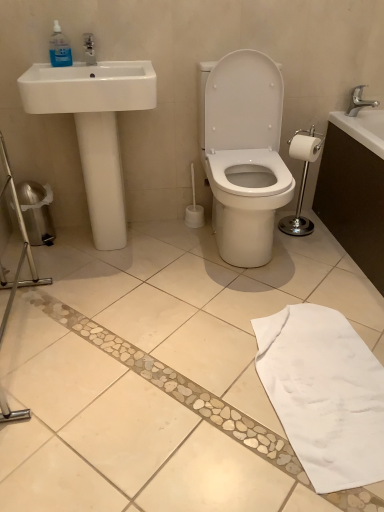
Question: Does silver metallic toilet paper holder at right have a greater height compared to white matte toilet paper at right?

Choices:
 (A) no
 (B) yes

Answer: (B)

Question: Can you confirm if silver metallic toilet paper holder at right is wider than white matte toilet paper at right?

Choices:
 (A) no
 (B) yes

Answer: (B)

Question: From the image's perspective, would you say silver metallic toilet paper holder at right is positioned over white matte toilet paper at right?

Choices:
 (A) no
 (B) yes

Answer: (A)

Question: Is silver metallic toilet paper holder at right thinner than white matte toilet paper at right?

Choices:
 (A) no
 (B) yes

Answer: (A)

Question: Is silver metallic toilet paper holder at right smaller than white matte toilet paper at right?

Choices:
 (A) yes
 (B) no

Answer: (B)

Question: From a real-world perspective, does silver metallic toilet paper holder at right stand above white matte toilet paper at right?

Choices:
 (A) no
 (B) yes

Answer: (A)

Question: Is white glossy sink at left to the left of white cotton bath towel at lower right from the viewer's perspective?

Choices:
 (A) no
 (B) yes

Answer: (B)

Question: Is the position of white glossy sink at left less distant than that of white cotton bath towel at lower right?

Choices:
 (A) no
 (B) yes

Answer: (A)

Question: Considering the relative sizes of white glossy sink at left and white cotton bath towel at lower right in the image provided, is white glossy sink at left taller than white cotton bath towel at lower right?

Choices:
 (A) yes
 (B) no

Answer: (A)

Question: From the image's perspective, is white glossy sink at left under white cotton bath towel at lower right?

Choices:
 (A) no
 (B) yes

Answer: (A)

Question: Considering the relative positions of white glossy sink at left and white cotton bath towel at lower right in the image provided, is white glossy sink at left to the right of white cotton bath towel at lower right from the viewer's perspective?

Choices:
 (A) no
 (B) yes

Answer: (A)

Question: Is white glossy sink at left with white cotton bath towel at lower right?

Choices:
 (A) yes
 (B) no

Answer: (B)

Question: From a real-world perspective, is silver metallic faucet at upper right below white matte toilet paper at right?

Choices:
 (A) no
 (B) yes

Answer: (A)